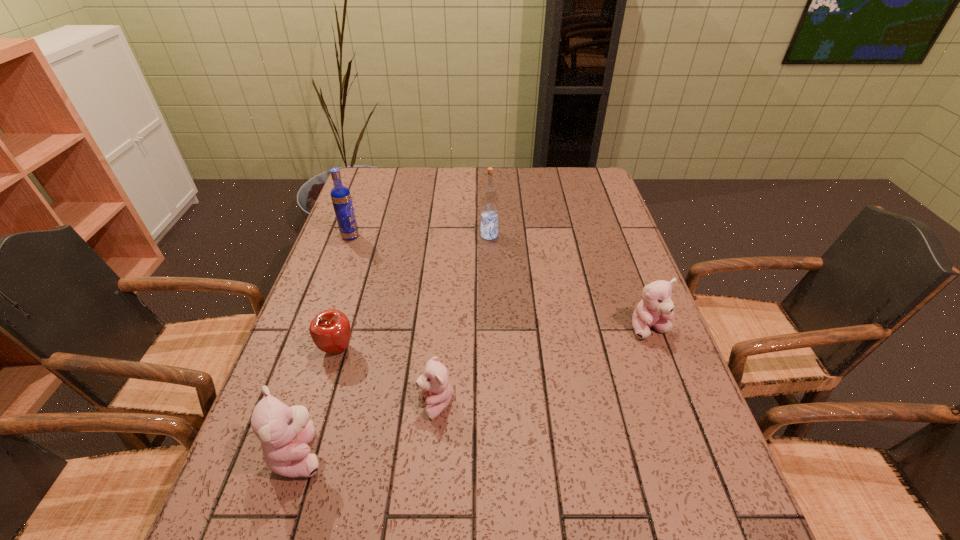
Locate an element on the screen. The width and height of the screenshot is (960, 540). vodka that is at the left edge is located at coordinates (341, 198).

Where is `object located at the right edge`? The height and width of the screenshot is (540, 960). object located at the right edge is located at coordinates (655, 309).

In order to click on object that is positioned at the near left corner in this screenshot , I will do `click(285, 432)`.

Locate an element on the screen. This screenshot has height=540, width=960. vacant space at the far edge of the desktop is located at coordinates (503, 170).

The height and width of the screenshot is (540, 960). Identify the location of vacant space at the left edge of the desktop. (374, 282).

Find the location of a particular element. This screenshot has height=540, width=960. vacant space at the right edge of the desktop is located at coordinates (621, 243).

This screenshot has width=960, height=540. I want to click on vacant space at the far left corner of the desktop, so click(376, 172).

You are a GUI agent. You are given a task and a screenshot of the screen. Output one action in this format:
    pyautogui.click(x=<x>, y=<y>)
    Task: Click on the vacant position at the far right corner of the desktop
    The height and width of the screenshot is (540, 960).
    Given the screenshot: What is the action you would take?
    tap(561, 186)

Locate an element on the screen. empty location between the apple and the rightmost object is located at coordinates (493, 339).

The height and width of the screenshot is (540, 960). Identify the location of free space between the nearest object and the right vodka. (395, 344).